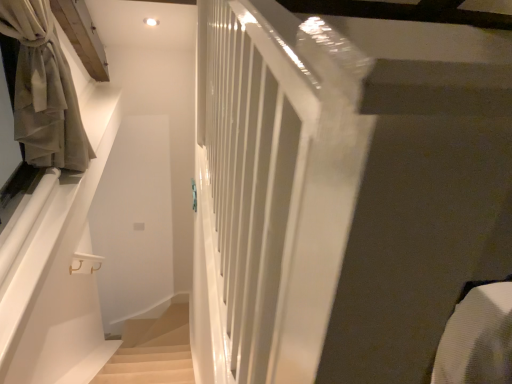
What do you see at coordinates (148, 365) in the screenshot? I see `beige carpeted stairs at lower left` at bounding box center [148, 365].

Looking at this image, what is the approximate width of beige carpeted stairs at lower left?

beige carpeted stairs at lower left is 3.45 inches in width.

This screenshot has height=384, width=512. In order to click on beige carpeted stairs at lower left in this screenshot , I will do point(148,365).

Image resolution: width=512 pixels, height=384 pixels. What do you see at coordinates (44, 90) in the screenshot?
I see `beige fabric curtain at left` at bounding box center [44, 90].

This screenshot has height=384, width=512. Find the location of `beige fabric curtain at left`. beige fabric curtain at left is located at coordinates (44, 90).

At what (x,y) coordinates should I click in order to perform the action: click on beige carpeted stairs at lower left. Please return your answer as a coordinate pair (x, y). This screenshot has height=384, width=512. Looking at the image, I should click on (148, 365).

Does beige carpeted stairs at lower left appear on the left side of beige fabric curtain at left?

Incorrect, beige carpeted stairs at lower left is not on the left side of beige fabric curtain at left.

Which object is further away from the camera, beige carpeted stairs at lower left or beige fabric curtain at left?

beige carpeted stairs at lower left is behind.

Considering the positions of point (134, 372) and point (62, 117), is point (134, 372) closer or farther from the camera than point (62, 117)?

Clearly, point (134, 372) is more distant from the camera than point (62, 117).

From the image's perspective, between beige carpeted stairs at lower left and beige fabric curtain at left, who is located below?

beige carpeted stairs at lower left, from the image's perspective.

From a real-world perspective, is beige carpeted stairs at lower left below beige fabric curtain at left?

Yes.

Considering the sizes of beige carpeted stairs at lower left and beige fabric curtain at left in the image, is beige carpeted stairs at lower left wider or thinner than beige fabric curtain at left?

In the image, beige carpeted stairs at lower left appears to be more narrow than beige fabric curtain at left.

Which of these two, beige carpeted stairs at lower left or beige fabric curtain at left, stands taller?

beige fabric curtain at left is taller.

Which of these two, beige carpeted stairs at lower left or beige fabric curtain at left, is smaller?

With smaller size is beige carpeted stairs at lower left.

Is beige carpeted stairs at lower left completely or partially outside of beige fabric curtain at left?

Indeed, beige carpeted stairs at lower left is completely outside beige fabric curtain at left.

Are beige carpeted stairs at lower left and beige fabric curtain at left beside each other?

No, beige carpeted stairs at lower left is not next to beige fabric curtain at left.

Is beige carpeted stairs at lower left positioned with its back to beige fabric curtain at left?

No, beige carpeted stairs at lower left is not facing the opposite direction of beige fabric curtain at left.

From the picture: How many degrees apart are the facing directions of beige carpeted stairs at lower left and beige fabric curtain at left?

beige carpeted stairs at lower left and beige fabric curtain at left are facing 8.08 degrees away from each other.

Identify the location of stairs below the beige fabric curtain at left (from the image's perspective). (148, 365).

Is beige fabric curtain at left at the left side of beige carpeted stairs at lower left?

Yes.

Is beige fabric curtain at left positioned behind beige carpeted stairs at lower left?

No.

Is point (50, 151) farther from viewer compared to point (186, 350)?

No, (50, 151) is closer to viewer.

Looking at this image, from the image's perspective, relative to beige carpeted stairs at lower left, is beige fabric curtain at left above or below?

From the image's perspective, beige fabric curtain at left appears above beige carpeted stairs at lower left.

From a real-world perspective, is beige fabric curtain at left physically located above or below beige carpeted stairs at lower left?

beige fabric curtain at left is above beige carpeted stairs at lower left.

Does beige fabric curtain at left have a greater width compared to beige carpeted stairs at lower left?

Yes, beige fabric curtain at left is wider than beige carpeted stairs at lower left.

Based on the photo, does beige fabric curtain at left have a greater height compared to beige carpeted stairs at lower left?

Indeed, beige fabric curtain at left has a greater height compared to beige carpeted stairs at lower left.

Who is smaller, beige fabric curtain at left or beige carpeted stairs at lower left?

With smaller size is beige carpeted stairs at lower left.

Is beige fabric curtain at left inside or outside of beige carpeted stairs at lower left?

beige fabric curtain at left is spatially situated outside beige carpeted stairs at lower left.

Are beige fabric curtain at left and beige carpeted stairs at lower left beside each other?

beige fabric curtain at left and beige carpeted stairs at lower left are clearly separated.

Is beige fabric curtain at left aimed at beige carpeted stairs at lower left?

No, beige fabric curtain at left is not turned towards beige carpeted stairs at lower left.

Find the location of `stairs that appears on the right of beige fabric curtain at left`. stairs that appears on the right of beige fabric curtain at left is located at coordinates (148, 365).

Where is `stairs that is under the beige fabric curtain at left (from a real-world perspective)`? This screenshot has height=384, width=512. stairs that is under the beige fabric curtain at left (from a real-world perspective) is located at coordinates (148, 365).

Where is `curtain above the beige carpeted stairs at lower left (from a real-world perspective)`? curtain above the beige carpeted stairs at lower left (from a real-world perspective) is located at coordinates (44, 90).